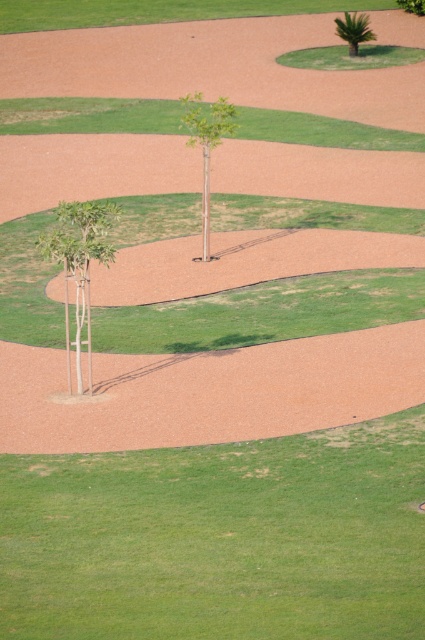
Question: Which point is farther to the camera?

Choices:
 (A) (65, 221)
 (B) (419, 8)
 (C) (207, 244)
 (D) (356, 35)

Answer: (B)

Question: Which point is farther to the camera?

Choices:
 (A) green matte tree at lower left
 (B) green matte tree at center
 (C) green leafy tree at upper center

Answer: (C)

Question: Does green matte tree at lower left appear on the right side of green leafy palm at upper center?

Choices:
 (A) yes
 (B) no

Answer: (B)

Question: Does green matte tree at center have a larger size compared to green leafy tree at upper center?

Choices:
 (A) no
 (B) yes

Answer: (B)

Question: Considering the relative positions of green leafy palm at upper center and green leafy tree at upper center in the image provided, where is green leafy palm at upper center located with respect to green leafy tree at upper center?

Choices:
 (A) left
 (B) right

Answer: (A)

Question: Which of the following is the farthest from the observer?

Choices:
 (A) (399, 1)
 (B) (354, 22)

Answer: (A)